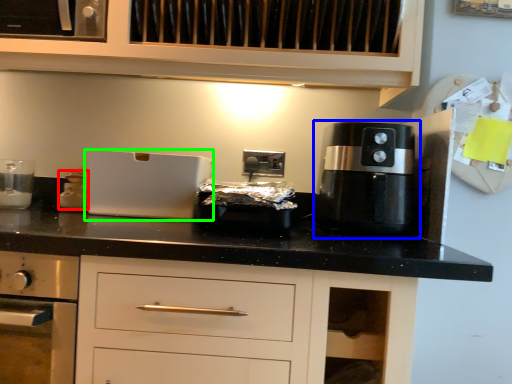
Question: Considering the real-world distances, which object is closest to kitchen appliance (highlighted by a red box)? coffee machine (highlighted by a blue box) or appliance (highlighted by a green box).

Choices:
 (A) coffee machine
 (B) appliance

Answer: (B)